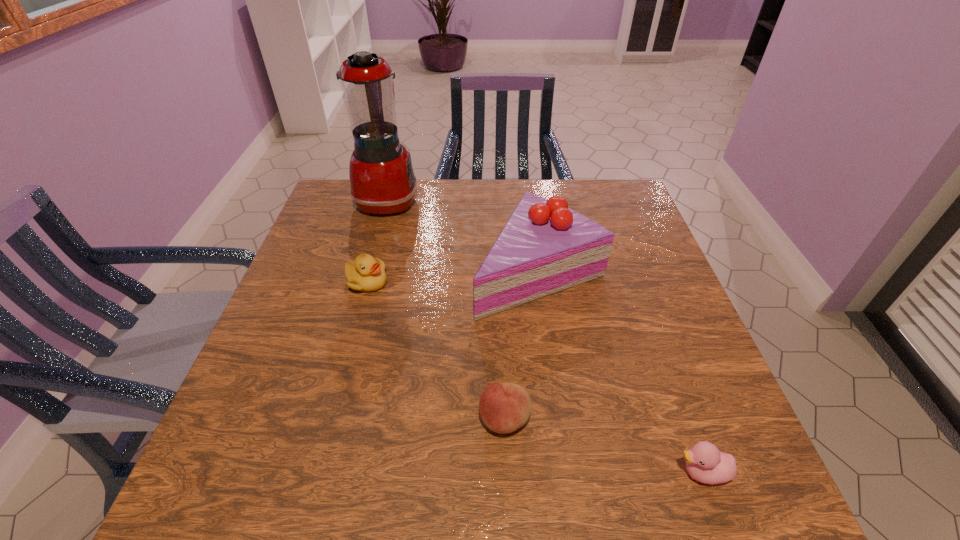
Find the location of a particular element. This screenshot has width=960, height=540. object that is the fourth closest to the second tallest object is located at coordinates (705, 463).

Locate an element on the screen. The width and height of the screenshot is (960, 540). vacant space that satisfies the following two spatial constraints: 1. on the front-facing side of the left duckling; 2. on the back side of the peach is located at coordinates (329, 420).

The height and width of the screenshot is (540, 960). I want to click on free space in the image that satisfies the following two spatial constraints: 1. on the back side of the peach; 2. on the controls of the food processor, so click(x=494, y=201).

This screenshot has height=540, width=960. What are the coordinates of `free location that satisfies the following two spatial constraints: 1. on the controls of the second nearest object; 2. on the right side of the food processor` in the screenshot? It's located at (327, 420).

Where is `free space that satisfies the following two spatial constraints: 1. on the controls of the farthest object; 2. on the back side of the fourth shortest object`? free space that satisfies the following two spatial constraints: 1. on the controls of the farthest object; 2. on the back side of the fourth shortest object is located at coordinates (368, 272).

The height and width of the screenshot is (540, 960). I want to click on vacant position in the image that satisfies the following two spatial constraints: 1. on the controls of the farthest object; 2. on the back side of the cake, so click(x=368, y=272).

Find the location of a particular element. free space that satisfies the following two spatial constraints: 1. on the back side of the fourth farthest object; 2. on the controls of the farthest object is located at coordinates (494, 201).

Find the location of a particular element. vacant space that satisfies the following two spatial constraints: 1. on the controls of the tallest object; 2. on the right side of the cake is located at coordinates (368, 272).